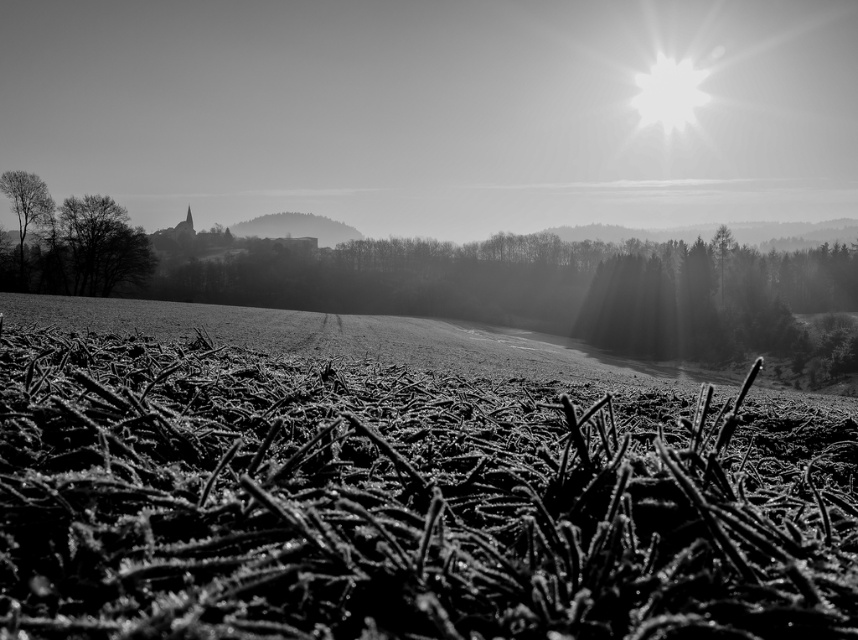
Question: Which point is farther to the camera?

Choices:
 (A) (155, 401)
 (B) (68, 209)

Answer: (B)

Question: Which point appears farthest from the camera in this image?

Choices:
 (A) (37, 216)
 (B) (112, 211)
 (C) (512, 449)

Answer: (B)

Question: Which of the following is the farthest from the observer?

Choices:
 (A) smooth bark tree at left
 (B) dark textured tree at left

Answer: (B)

Question: Does frosted grass at center have a larger size compared to dark textured tree at left?

Choices:
 (A) yes
 (B) no

Answer: (B)

Question: Can you confirm if frosted grass at center is bigger than dark textured tree at left?

Choices:
 (A) yes
 (B) no

Answer: (B)

Question: Is frosted grass at center thinner than dark textured tree at left?

Choices:
 (A) no
 (B) yes

Answer: (B)